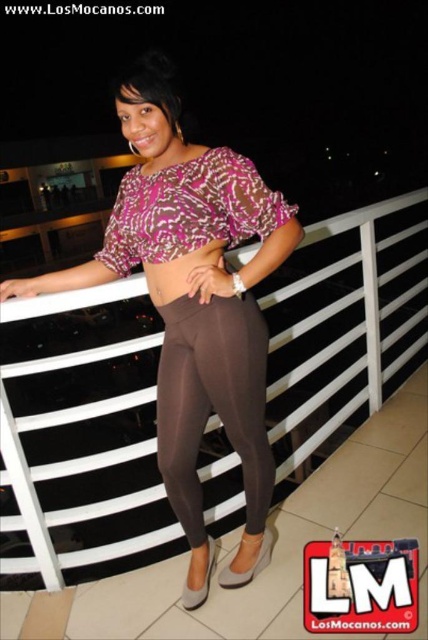
Can you confirm if brown smooth leggings at center is wider than brown matte leggings at center?

Yes, brown smooth leggings at center is wider than brown matte leggings at center.

Can you confirm if brown smooth leggings at center is positioned below brown matte leggings at center?

Correct, brown smooth leggings at center is located below brown matte leggings at center.

Where is `brown smooth leggings at center`? The image size is (428, 640). brown smooth leggings at center is located at coordinates (213, 403).

Where is `brown smooth leggings at center`? brown smooth leggings at center is located at coordinates (213, 403).

Can you confirm if matte brown leggings at center is positioned to the left of brown matte leggings at center?

Indeed, matte brown leggings at center is positioned on the left side of brown matte leggings at center.

Does matte brown leggings at center appear under brown matte leggings at center?

Correct, matte brown leggings at center is located below brown matte leggings at center.

Is point (169, 252) more distant than point (222, 244)?

No, (169, 252) is closer to viewer.

At what (x,y) coordinates should I click in order to perform the action: click on matte brown leggings at center. Please return your answer as a coordinate pair (x, y). The width and height of the screenshot is (428, 640). Looking at the image, I should click on (193, 307).

Does matte brown leggings at center have a lesser width compared to brown smooth leggings at center?

No, matte brown leggings at center is not thinner than brown smooth leggings at center.

Does point (223, 346) lie behind point (186, 412)?

No, (223, 346) is closer to viewer.

Find the location of a particular element. This screenshot has width=428, height=640. matte brown leggings at center is located at coordinates (193, 307).